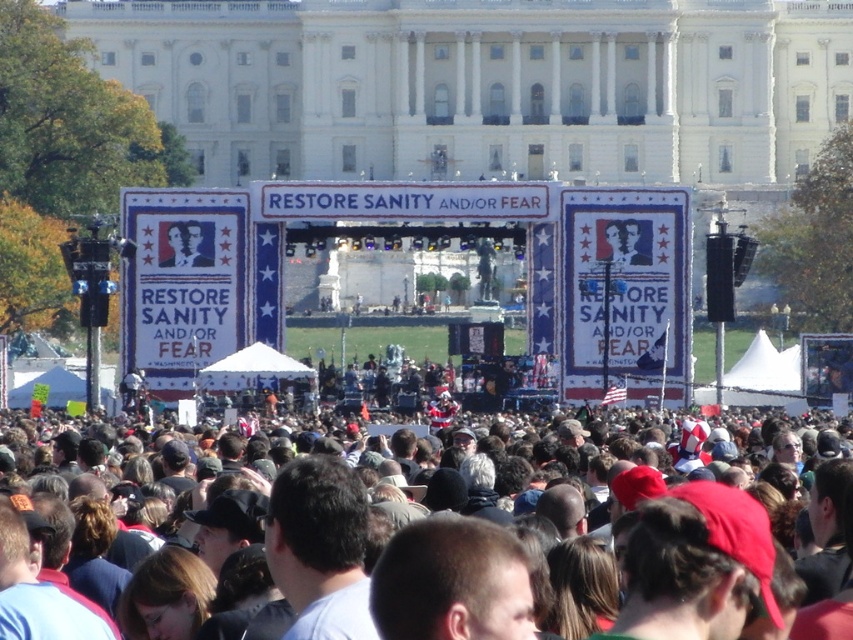
You are a photographer at the event and want to capture both the dark brown hair at center and the matte black portrait at center in a single frame. Given that your camera has a fixed focal length, which object should you focus on to ensure both are in the frame without cropping?

You should focus on the dark brown hair at center because its width is larger than the matte black portrait at center, so centering on it would naturally include the smaller matte black portrait at center within the frame.

You are a photographer at the event and want to capture a photo of the dark brown hair at center and the matte black portrait at center. Which object is located lower in the frame?

The dark brown hair at center is positioned under the matte black portrait at center, so it is located lower in the frame.

You are a photographer at the event and want to take a photo of both the dark brown hair at center and the matte black portrait at center. However, you can only focus on one subject at a time. Which subject should you focus on to ensure the other is still somewhat in focus due to their relative sizes?

The dark brown hair at center is much taller than the matte black portrait at center. To ensure both are somewhat in focus, you should focus on the dark brown hair at center since it is larger and closer to the camera, which typically results in a smaller depth of field requiring focus on the closer subject for better overall sharpness.